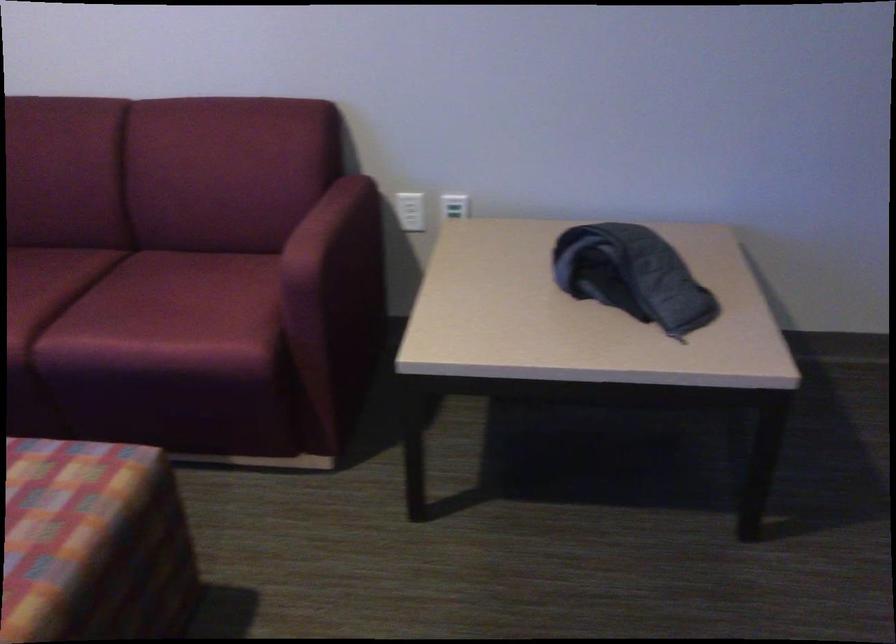
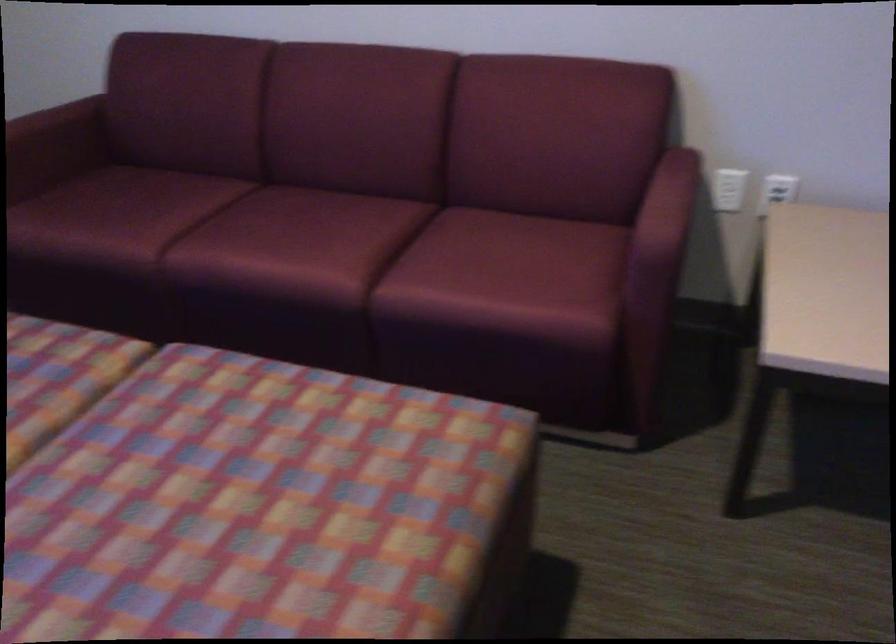
The point at (342, 192) is marked in the first image. Where is the corresponding point in the second image?

(678, 166)